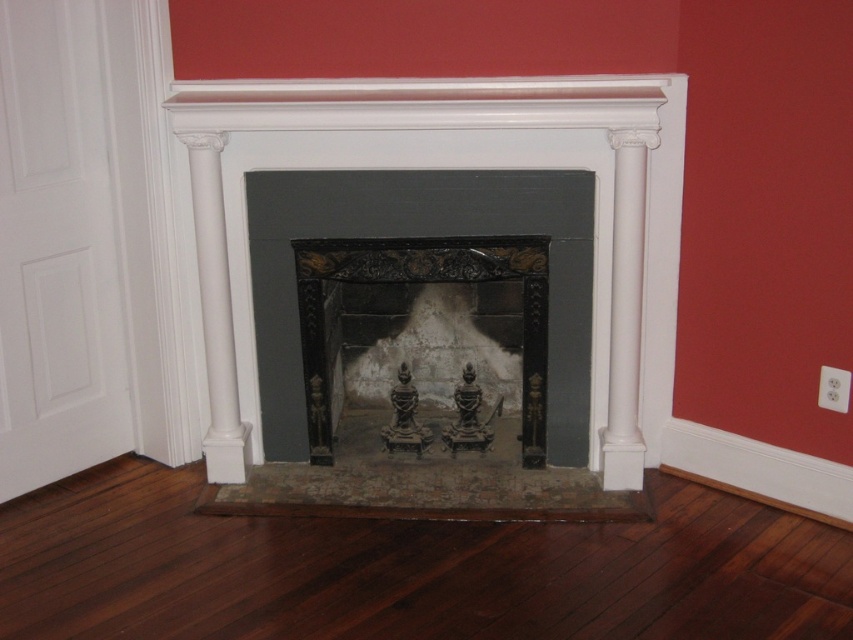
Can you confirm if dark brown wood flooring at center is positioned to the right of black marble fireplace at center?

Incorrect, dark brown wood flooring at center is not on the right side of black marble fireplace at center.

Between dark brown wood flooring at center and black marble fireplace at center, which one has less height?

dark brown wood flooring at center

The height and width of the screenshot is (640, 853). What do you see at coordinates (407, 570) in the screenshot? I see `dark brown wood flooring at center` at bounding box center [407, 570].

Image resolution: width=853 pixels, height=640 pixels. I want to click on dark brown wood flooring at center, so click(407, 570).

Who is positioned more to the right, black marble fireplace at center or black polished wood fireplace at center?

Positioned to the right is black marble fireplace at center.

Which of these two, black marble fireplace at center or black polished wood fireplace at center, stands shorter?

black polished wood fireplace at center is shorter.

Who is more forward, (672, 280) or (436, 260)?

Point (436, 260) is more forward.

The width and height of the screenshot is (853, 640). I want to click on black marble fireplace at center, so click(x=422, y=168).

Based on the photo, how distant is dark brown wood flooring at center from black polished wood fireplace at center?

The distance of dark brown wood flooring at center from black polished wood fireplace at center is 29.60 inches.

Between point (160, 625) and point (527, 362), which one is positioned behind?

Positioned behind is point (527, 362).

Where is `dark brown wood flooring at center`? dark brown wood flooring at center is located at coordinates (407, 570).